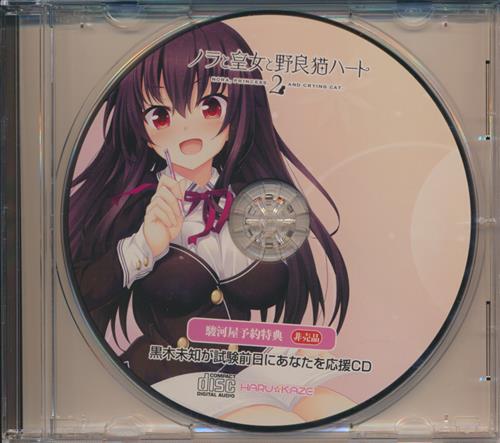
Locate an element on the screen. This screenshot has height=443, width=500. cd binding is located at coordinates (11, 174).